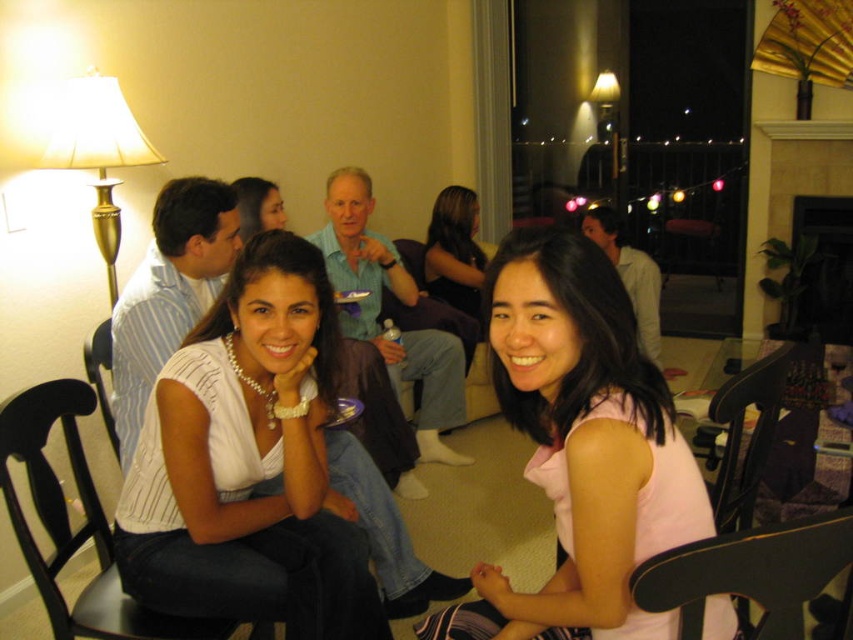
You are a photographer at this event and want to capture a closeup of the white pearl necklace at center and the matte black hair at center. Which object is positioned lower on the person?

The white pearl necklace at center is located below matte black hair at center, so the white pearl necklace at center is positioned lower on the person.

You are a photographer at the event and want to capture a photo of both the smooth brown hair at center and the matte black hair at center without any obstruction. Based on their positions, which one should you adjust the camera angle to focus on first?

The matte black hair at center is behind smooth brown hair at center, so you should focus on the smooth brown hair at center first to avoid obstruction.